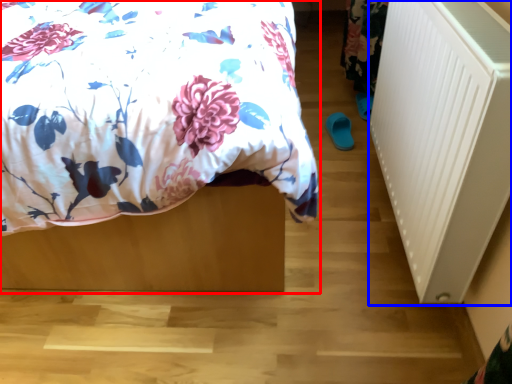
Question: Which point is closer to the camera, bed (highlighted by a red box) or radiator (highlighted by a blue box)?

Choices:
 (A) bed
 (B) radiator

Answer: (A)